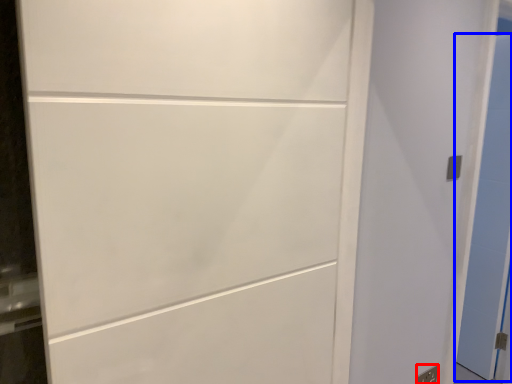
Question: Which object is closer to the camera taking this photo, electric outlet (highlighted by a red box) or door (highlighted by a blue box)?

Choices:
 (A) electric outlet
 (B) door

Answer: (A)